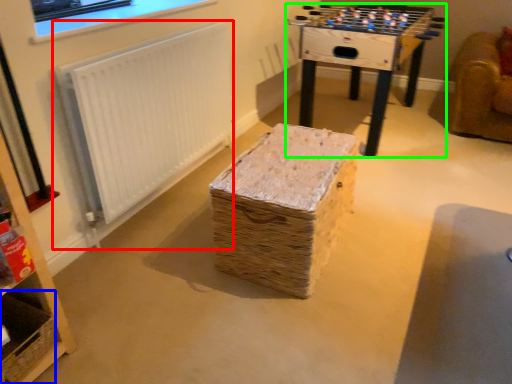
Question: Estimate the real-world distances between objects in this image. Which object is closer to radiator (highlighted by a red box), basket (highlighted by a blue box) or table (highlighted by a green box)?

Choices:
 (A) basket
 (B) table

Answer: (A)